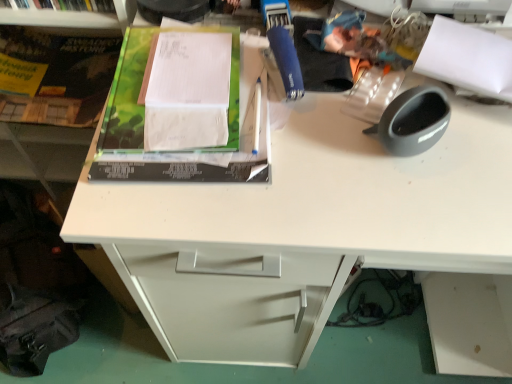
What do you see at coordinates (72, 17) in the screenshot? The height and width of the screenshot is (384, 512). I see `white plastic shelf at upper left` at bounding box center [72, 17].

Identify the location of green matte paper at upper left, marked as the first paperback book in a front-to-back arrangement. (183, 109).

This screenshot has height=384, width=512. I want to click on green matte book at upper left, so [55, 89].

Find the location of `shelf that is in front of the hardcover book at upper left, the second paperback book viewed from the front`. shelf that is in front of the hardcover book at upper left, the second paperback book viewed from the front is located at coordinates (72, 17).

Between hardcover book at upper left, which is the first paperback book in left-to-right order, and white plastic shelf at upper left, which one has smaller width?

A: white plastic shelf at upper left.

From the picture: Between hardcover book at upper left, which is the first paperback book in left-to-right order, and white plastic shelf at upper left, which one is positioned behind?

hardcover book at upper left, which is the first paperback book in left-to-right order.

How different are the orientations of hardcover book at upper left, arranged as the second paperback book when viewed from the right, and white plastic shelf at upper left in degrees?

They differ by 0.000216 degrees in their facing directions.

Is point (3, 18) closer or farther from the camera than point (91, 119)?

Clearly, point (3, 18) is closer to the camera than point (91, 119).

Is white plastic shelf at upper left oriented away from hardcover book at upper left, the second paperback book viewed from the front?

No, white plastic shelf at upper left is not facing away from hardcover book at upper left, the second paperback book viewed from the front.

Is white plastic shelf at upper left in contact with hardcover book at upper left, which is the first paperback book in left-to-right order?

They are not placed beside each other.

Considering the positions of points (199, 150) and (18, 41), is point (199, 150) closer to camera compared to point (18, 41)?

Yes.

Where is `paperback book behind the green matte paper at upper left, the second paperback book when ordered from left to right`? This screenshot has height=384, width=512. paperback book behind the green matte paper at upper left, the second paperback book when ordered from left to right is located at coordinates (54, 76).

Looking at their sizes, would you say green matte paper at upper left, the second paperback book when ordered from left to right, is wider or thinner than hardcover book at upper left, which is the first paperback book in left-to-right order?

Considering their sizes, green matte paper at upper left, the second paperback book when ordered from left to right, looks broader than hardcover book at upper left, which is the first paperback book in left-to-right order.

From a real-world perspective, which is physically below, green matte paper at upper left, the 2th paperback book viewed from the back, or hardcover book at upper left, which appears as the 1th paperback book when viewed from the back?

hardcover book at upper left, which appears as the 1th paperback book when viewed from the back.

From the picture: Considering the positions of objects green matte book at upper left and hardcover book at upper left, which is the first paperback book in left-to-right order, in the image provided, who is more to the left, green matte book at upper left or hardcover book at upper left, which is the first paperback book in left-to-right order,?

From the viewer's perspective, green matte book at upper left appears more on the left side.

Is point (56, 197) behind point (32, 37)?

Yes, it is behind point (32, 37).

Identify the location of paperback book behind the green matte book at upper left. Image resolution: width=512 pixels, height=384 pixels. (54, 76).

Would you say green matte book at upper left is inside or outside hardcover book at upper left, the second paperback book viewed from the front?

green matte book at upper left is not enclosed by hardcover book at upper left, the second paperback book viewed from the front.

Which is in front, point (92, 113) or point (46, 12)?

The point (46, 12) is closer to the camera.

Is green matte book at upper left directly adjacent to white plastic shelf at upper left?

Absolutely, green matte book at upper left is next to and touching white plastic shelf at upper left.

From a real-world perspective, is green matte book at upper left located higher than white plastic shelf at upper left?

Incorrect, from a real-world perspective, green matte book at upper left is lower than white plastic shelf at upper left.

From the image's perspective, who appears lower, hardcover book at upper left, the second paperback book viewed from the front, or green matte book at upper left?

green matte book at upper left.

Is hardcover book at upper left, which is the first paperback book in left-to-right order, looking in the opposite direction of green matte book at upper left?

Yes, hardcover book at upper left, which is the first paperback book in left-to-right order, is positioned with its back facing green matte book at upper left.

From a real-world perspective, who is located lower, hardcover book at upper left, which is the first paperback book in left-to-right order, or green matte book at upper left?

In real-world perspective, green matte book at upper left is lower.

Which is more distant, [16,43] or [100,55]?

Positioned behind is point [16,43].

How far apart are green matte paper at upper left, marked as the first paperback book in a front-to-back arrangement, and green matte book at upper left?

green matte paper at upper left, marked as the first paperback book in a front-to-back arrangement, is 26.27 centimeters from green matte book at upper left.

Considering the sizes of green matte paper at upper left, arranged as the 1th paperback book when viewed from the right, and green matte book at upper left in the image, is green matte paper at upper left, arranged as the 1th paperback book when viewed from the right, taller or shorter than green matte book at upper left?

Clearly, green matte paper at upper left, arranged as the 1th paperback book when viewed from the right, is shorter compared to green matte book at upper left.

Can you confirm if green matte paper at upper left, the second paperback book when ordered from left to right, is bigger than green matte book at upper left?

No, green matte paper at upper left, the second paperback book when ordered from left to right, is not bigger than green matte book at upper left.

Is green matte paper at upper left, the 2th paperback book viewed from the back, turned away from green matte book at upper left?

No.

Locate an element on the screen. shelf above the hardcover book at upper left, which appears as the 1th paperback book when viewed from the back (from a real-world perspective) is located at coordinates (72, 17).

At what (x,y) coordinates should I click in order to perform the action: click on shelf lying above the hardcover book at upper left, arranged as the second paperback book when viewed from the right (from the image's perspective). Please return your answer as a coordinate pair (x, y). The width and height of the screenshot is (512, 384). Looking at the image, I should click on (72, 17).

Based on their spatial positions, is green matte paper at upper left, the second paperback book when ordered from left to right, or hardcover book at upper left, which appears as the 1th paperback book when viewed from the back, further from white plastic shelf at upper left?

green matte paper at upper left, the second paperback book when ordered from left to right, is further to white plastic shelf at upper left.

Estimate the real-world distances between objects in this image. Which object is further from hardcover book at upper left, the second paperback book viewed from the front, green matte book at upper left or white plastic shelf at upper left?

white plastic shelf at upper left is further to hardcover book at upper left, the second paperback book viewed from the front.

From the picture: Considering their positions, is hardcover book at upper left, arranged as the second paperback book when viewed from the right, positioned further to white plastic shelf at upper left than green matte paper at upper left, arranged as the 1th paperback book when viewed from the right?

green matte paper at upper left, arranged as the 1th paperback book when viewed from the right.

Considering their positions, is green matte book at upper left positioned further to green matte paper at upper left, the second paperback book when ordered from left to right, than hardcover book at upper left, arranged as the second paperback book when viewed from the right?

Among the two, hardcover book at upper left, arranged as the second paperback book when viewed from the right, is located further to green matte paper at upper left, the second paperback book when ordered from left to right.

When comparing their distances from hardcover book at upper left, which is the first paperback book in left-to-right order, does green matte paper at upper left, arranged as the 1th paperback book when viewed from the right, or white plastic shelf at upper left seem further?

green matte paper at upper left, arranged as the 1th paperback book when viewed from the right.

When comparing their distances from green matte paper at upper left, the 2th paperback book viewed from the back, does hardcover book at upper left, which appears as the 1th paperback book when viewed from the back, or white plastic shelf at upper left seem closer?

Based on the image, white plastic shelf at upper left appears to be nearer to green matte paper at upper left, the 2th paperback book viewed from the back.

Based on their spatial positions, is green matte book at upper left or green matte paper at upper left, marked as the first paperback book in a front-to-back arrangement, further from white plastic shelf at upper left?

Among the two, green matte paper at upper left, marked as the first paperback book in a front-to-back arrangement, is located further to white plastic shelf at upper left.

Estimate the real-world distances between objects in this image. Which object is closer to green matte paper at upper left, arranged as the 1th paperback book when viewed from the right, white plastic shelf at upper left or green matte book at upper left?

The object closer to green matte paper at upper left, arranged as the 1th paperback book when viewed from the right, is white plastic shelf at upper left.

In order to click on shelf situated between green matte book at upper left and green matte paper at upper left, marked as the first paperback book in a front-to-back arrangement, from left to right in this screenshot , I will do `click(72, 17)`.

At what (x,y) coordinates should I click in order to perform the action: click on paperback book between green matte book at upper left and green matte paper at upper left, the second paperback book when ordered from left to right, in the horizontal direction. Please return your answer as a coordinate pair (x, y). Image resolution: width=512 pixels, height=384 pixels. Looking at the image, I should click on pos(54,76).

At what (x,y) coordinates should I click in order to perform the action: click on shelf situated between hardcover book at upper left, the second paperback book viewed from the front, and green matte paper at upper left, marked as the first paperback book in a front-to-back arrangement, from left to right. Please return your answer as a coordinate pair (x, y). The height and width of the screenshot is (384, 512). Looking at the image, I should click on (72, 17).

This screenshot has height=384, width=512. What are the coordinates of `paperback book between white plastic shelf at upper left and green matte book at upper left from top to bottom` in the screenshot? It's located at (54, 76).